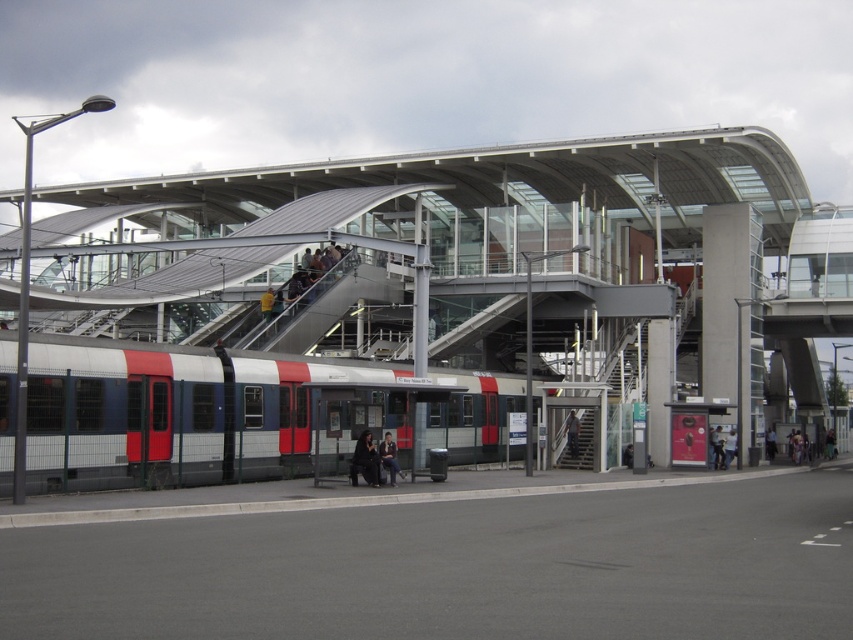
Question: Does metallic train at left come behind red and white metal train at center?

Choices:
 (A) yes
 (B) no

Answer: (B)

Question: Can you confirm if red and white metal train at center is positioned below metallic gray staircase at center?

Choices:
 (A) yes
 (B) no

Answer: (A)

Question: Among these objects, which one is farthest from the camera?

Choices:
 (A) red and white metal train at center
 (B) metallic train at left

Answer: (A)

Question: Which of the following is the farthest from the observer?

Choices:
 (A) (596, 444)
 (B) (360, 436)

Answer: (A)

Question: Is metallic train at left closer to the viewer compared to metallic gray staircase at center?

Choices:
 (A) yes
 (B) no

Answer: (A)

Question: Which of the following is the farthest from the observer?

Choices:
 (A) (389, 451)
 (B) (219, 472)
 (C) (358, 442)

Answer: (A)